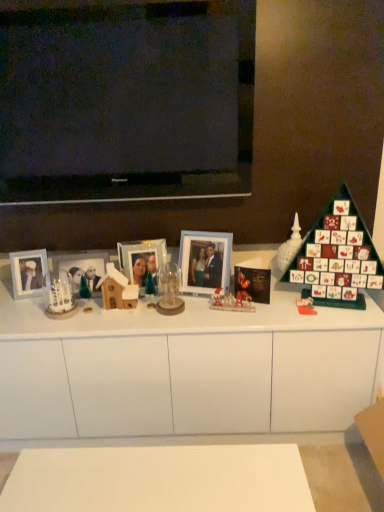
Where is `free spot in front of translucent plastic figurines at center, placed as the 3th toy when sorted from left to right`? The height and width of the screenshot is (512, 384). free spot in front of translucent plastic figurines at center, placed as the 3th toy when sorted from left to right is located at coordinates (233, 320).